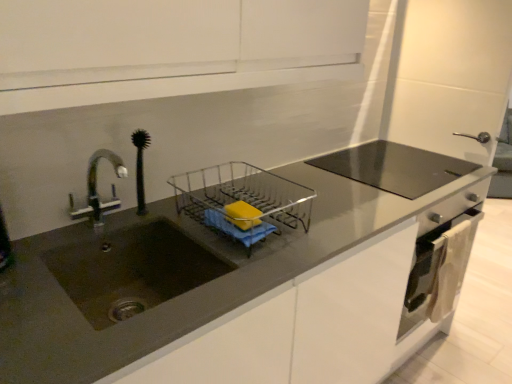
Image resolution: width=512 pixels, height=384 pixels. What are the coordinates of `vacant position to the left of yellow matte soap at center` in the screenshot? It's located at (192, 225).